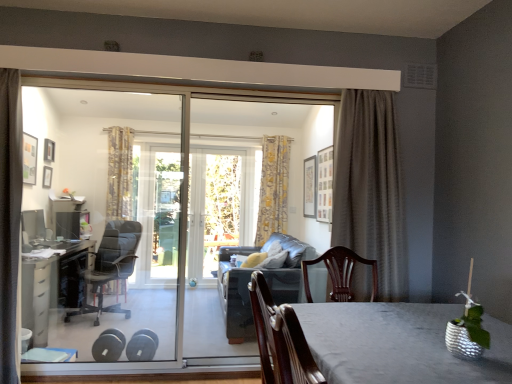
What do you see at coordinates (119, 173) in the screenshot? The image size is (512, 384). I see `yellow floral fabric curtain at left, acting as the first curtain starting from the left` at bounding box center [119, 173].

How much space does yellow floral fabric curtain at center, positioned as the 3th curtain in front-to-back order, occupy vertically?

yellow floral fabric curtain at center, positioned as the 3th curtain in front-to-back order, is 5.17 feet tall.

This screenshot has height=384, width=512. I want to click on dark gray leather couch at center, so click(236, 294).

The width and height of the screenshot is (512, 384). In order to click on black plastic desk at left, the second table in the front-to-back sequence in this screenshot , I will do `click(51, 287)`.

I want to click on transparent glass door at center, so coord(156,219).

This screenshot has width=512, height=384. I want to click on dark grey textured curtain at right, the 3th curtain when ordered from left to right, so click(370, 189).

Between dark gray leather couch at center and dark grey textured curtain at right, marked as the 1th curtain in a front-to-back arrangement, which one appears on the left side from the viewer's perspective?

From the viewer's perspective, dark gray leather couch at center appears more on the left side.

Does dark gray leather couch at center come behind dark grey textured curtain at right, which appears as the third curtain when viewed from the back?

Yes, dark gray leather couch at center is further from the viewer.

From the image's perspective, is dark gray leather couch at center above or below dark grey textured curtain at right, marked as the 1th curtain in a front-to-back arrangement?

Clearly, from the image's perspective, dark gray leather couch at center is below dark grey textured curtain at right, marked as the 1th curtain in a front-to-back arrangement.

Does dark gray leather couch at center have a greater height compared to dark grey textured curtain at right, the 3th curtain when ordered from left to right?

No, dark gray leather couch at center is not taller than dark grey textured curtain at right, the 3th curtain when ordered from left to right.

Which is less distant, (355, 93) or (126, 271)?

Clearly, point (355, 93) is closer to the camera than point (126, 271).

Based on the photo, which object is further away from the camera taking this photo, dark grey textured curtain at right, which appears as the third curtain when viewed from the back, or black leather office chair at left?

black leather office chair at left is further from the camera.

Based on the photo, can we say dark grey textured curtain at right, acting as the first curtain starting from the right, lies outside black leather office chair at left?

Yes, dark grey textured curtain at right, acting as the first curtain starting from the right, is located beyond the bounds of black leather office chair at left.

In terms of height, does dark grey textured curtain at right, marked as the 1th curtain in a front-to-back arrangement, look taller or shorter compared to black leather office chair at left?

Clearly, dark grey textured curtain at right, marked as the 1th curtain in a front-to-back arrangement, is taller compared to black leather office chair at left.

Are yellow floral fabric curtain at center, acting as the 1th curtain starting from the back, and black leather office chair at left far apart?

Yes, yellow floral fabric curtain at center, acting as the 1th curtain starting from the back, and black leather office chair at left are located far from each other.

Based on the photo, is yellow floral fabric curtain at center, which is counted as the 2th curtain, starting from the left, oriented towards black leather office chair at left?

No.

Considering the relative sizes of yellow floral fabric curtain at center, positioned as the 3th curtain in front-to-back order, and black leather office chair at left in the image provided, is yellow floral fabric curtain at center, positioned as the 3th curtain in front-to-back order, shorter than black leather office chair at left?

Incorrect, the height of yellow floral fabric curtain at center, positioned as the 3th curtain in front-to-back order, does not fall short of that of black leather office chair at left.

Who is shorter, dark grey textured curtain at right, marked as the 1th curtain in a front-to-back arrangement, or yellow floral fabric curtain at center, the second curtain when ordered from right to left?

dark grey textured curtain at right, marked as the 1th curtain in a front-to-back arrangement, is shorter.

Considering the relative sizes of dark grey textured curtain at right, the 3th curtain when ordered from left to right, and yellow floral fabric curtain at center, acting as the 1th curtain starting from the back, in the image provided, is dark grey textured curtain at right, the 3th curtain when ordered from left to right, wider than yellow floral fabric curtain at center, acting as the 1th curtain starting from the back,?

Yes.

Which of these two, dark grey textured curtain at right, which appears as the third curtain when viewed from the back, or yellow floral fabric curtain at center, positioned as the 3th curtain in front-to-back order, is smaller?

yellow floral fabric curtain at center, positioned as the 3th curtain in front-to-back order.

Image resolution: width=512 pixels, height=384 pixels. In order to click on curtain above the dark grey textured curtain at right, marked as the 1th curtain in a front-to-back arrangement (from the image's perspective) in this screenshot , I will do `click(273, 188)`.

Who is shorter, black leather office chair at left or yellow floral fabric curtain at left, marked as the second curtain in a front-to-back arrangement?

black leather office chair at left is shorter.

Is black leather office chair at left touching yellow floral fabric curtain at left, marked as the second curtain in a front-to-back arrangement?

There is a gap between black leather office chair at left and yellow floral fabric curtain at left, marked as the second curtain in a front-to-back arrangement.

Measure the distance from black leather office chair at left to yellow floral fabric curtain at left, which is the third curtain from right to left.

black leather office chair at left and yellow floral fabric curtain at left, which is the third curtain from right to left, are 28.26 inches apart.

Between black leather office chair at left and yellow floral fabric curtain at left, which is the third curtain from right to left, which one is positioned in front?

Positioned in front is black leather office chair at left.

What's the angular difference between transparent glass door at center and silvery metallic table at center, which is counted as the second table, starting from the left,'s facing directions?

89.5 degrees separate the facing orientations of transparent glass door at center and silvery metallic table at center, which is counted as the second table, starting from the left.

Considering their positions, is transparent glass door at center located in front of or behind silvery metallic table at center, which is counted as the second table, starting from the left?

transparent glass door at center is behind silvery metallic table at center, which is counted as the second table, starting from the left.

Is transparent glass door at center facing towards silvery metallic table at center, which is the 2th table in back-to-front order?

Yes, transparent glass door at center is aimed at silvery metallic table at center, which is the 2th table in back-to-front order.

From the image's perspective, is transparent glass door at center under silvery metallic table at center, which is the 1th table in right-to-left order?

No, from the image's perspective, transparent glass door at center is not beneath silvery metallic table at center, which is the 1th table in right-to-left order.

Considering the relative positions of black plastic desk at left, the second table in the front-to-back sequence, and dark grey textured curtain at right, marked as the 1th curtain in a front-to-back arrangement, in the image provided, is black plastic desk at left, the second table in the front-to-back sequence, to the right of dark grey textured curtain at right, marked as the 1th curtain in a front-to-back arrangement, from the viewer's perspective?

In fact, black plastic desk at left, the second table in the front-to-back sequence, is to the left of dark grey textured curtain at right, marked as the 1th curtain in a front-to-back arrangement.

Between black plastic desk at left, the 1th table viewed from the left, and dark grey textured curtain at right, which appears as the third curtain when viewed from the back, which one has less height?

With less height is black plastic desk at left, the 1th table viewed from the left.

From the image's perspective, which one is positioned higher, black plastic desk at left, the 1th table viewed from the left, or dark grey textured curtain at right, marked as the 1th curtain in a front-to-back arrangement?

dark grey textured curtain at right, marked as the 1th curtain in a front-to-back arrangement, from the image's perspective.

Is black plastic desk at left, which appears as the second table when viewed from the right, positioned beyond the bounds of dark grey textured curtain at right, acting as the first curtain starting from the right?

Absolutely, black plastic desk at left, which appears as the second table when viewed from the right, is external to dark grey textured curtain at right, acting as the first curtain starting from the right.

You are a GUI agent. You are given a task and a screenshot of the screen. Output one action in this format:
    pyautogui.click(x=<x>, y=<y>)
    Task: Click on the studio couch lying behind the dark grey textured curtain at right, acting as the first curtain starting from the right
    The width and height of the screenshot is (512, 384).
    Given the screenshot: What is the action you would take?
    pyautogui.click(x=236, y=294)

Identify the location of the 2nd curtain above the black leather office chair at left (from the image's perspective). This screenshot has height=384, width=512. (370, 189).

Looking at the image, which one is located closer to transparent glass door at center, dark grey textured curtain at right, marked as the 1th curtain in a front-to-back arrangement, or black plastic desk at left, the second table in the front-to-back sequence?

The object closer to transparent glass door at center is black plastic desk at left, the second table in the front-to-back sequence.

From the picture: Looking at the image, which one is located closer to black leather office chair at left, transparent glass door at center or dark grey textured curtain at right, the 3th curtain when ordered from left to right?

Based on the image, transparent glass door at center appears to be nearer to black leather office chair at left.

Looking at the image, which one is located closer to silvery metallic table at center, which is the 2th table in back-to-front order, yellow floral fabric curtain at left, acting as the first curtain starting from the left, or dark grey textured curtain at right, marked as the 1th curtain in a front-to-back arrangement?

dark grey textured curtain at right, marked as the 1th curtain in a front-to-back arrangement, lies closer to silvery metallic table at center, which is the 2th table in back-to-front order, than the other object.

Considering their positions, is transparent glass door at center positioned closer to black leather office chair at left than yellow floral fabric curtain at center, positioned as the 3th curtain in front-to-back order?

transparent glass door at center is positioned closer to the anchor black leather office chair at left.

Considering their positions, is black plastic desk at left, the 1th table viewed from the left, positioned further to yellow floral fabric curtain at center, which is counted as the 2th curtain, starting from the left, than dark gray leather couch at center?

black plastic desk at left, the 1th table viewed from the left.

When comparing their distances from dark grey textured curtain at right, the 3th curtain when ordered from left to right, does yellow floral fabric curtain at left, acting as the first curtain starting from the left, or black plastic desk at left, which appears as the second table when viewed from the right, seem closer?

black plastic desk at left, which appears as the second table when viewed from the right, lies closer to dark grey textured curtain at right, the 3th curtain when ordered from left to right, than the other object.

Estimate the real-world distances between objects in this image. Which object is further from yellow floral fabric curtain at center, positioned as the 3th curtain in front-to-back order, dark gray leather couch at center or transparent glass door at center?

Among the two, dark gray leather couch at center is located further to yellow floral fabric curtain at center, positioned as the 3th curtain in front-to-back order.

Considering their positions, is dark grey textured curtain at right, marked as the 1th curtain in a front-to-back arrangement, positioned further to dark gray leather couch at center than yellow floral fabric curtain at left, which is the third curtain from right to left?

yellow floral fabric curtain at left, which is the third curtain from right to left, is further to dark gray leather couch at center.

The image size is (512, 384). What are the coordinates of `chair located between dark gray leather couch at center and yellow floral fabric curtain at center, which is counted as the 2th curtain, starting from the left, in the depth direction` in the screenshot? It's located at (110, 266).

You are a GUI agent. You are given a task and a screenshot of the screen. Output one action in this format:
    pyautogui.click(x=<x>, y=<y>)
    Task: Click on the chair located between yellow floral fabric curtain at left, which is the third curtain from right to left, and dark gray leather couch at center in the left-right direction
    The image size is (512, 384).
    Given the screenshot: What is the action you would take?
    pyautogui.click(x=110, y=266)

Identify the location of table between silvery metallic table at center, which is the 1th table in right-to-left order, and yellow floral fabric curtain at left, which is the third curtain from right to left, from front to back. (51, 287).

You are a GUI agent. You are given a task and a screenshot of the screen. Output one action in this format:
    pyautogui.click(x=<x>, y=<y>)
    Task: Click on the chair between transparent glass door at center and yellow floral fabric curtain at left, which is the third curtain from right to left, along the z-axis
    
    Given the screenshot: What is the action you would take?
    pyautogui.click(x=110, y=266)